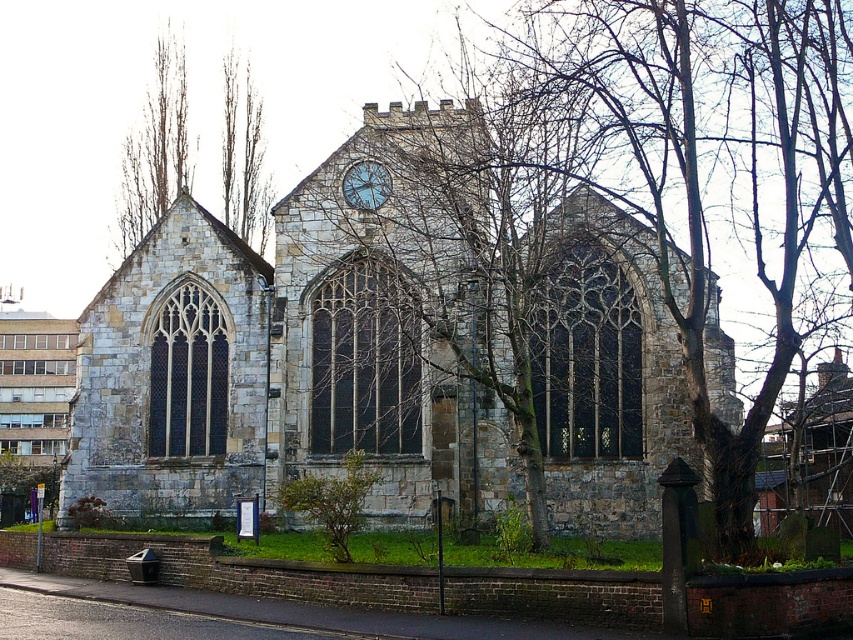
Question: Which is farther from the blue stone clock at center?

Choices:
 (A) bare wood tree at upper left
 (B) stone church at center

Answer: (A)

Question: Which point appears farthest from the camera in this image?

Choices:
 (A) (125, 172)
 (B) (390, 474)
 (C) (375, 168)

Answer: (A)

Question: Does stone church at center appear over bare wood tree at upper left?

Choices:
 (A) yes
 (B) no

Answer: (B)

Question: Is stone church at center above bare wood tree at upper left?

Choices:
 (A) yes
 (B) no

Answer: (B)

Question: Observing the image, what is the correct spatial positioning of stone church at center in reference to blue stone clock at center?

Choices:
 (A) right
 (B) left

Answer: (A)

Question: Which object is the closest to the stone church at center?

Choices:
 (A) bare wood tree at upper left
 (B) blue stone clock at center

Answer: (B)